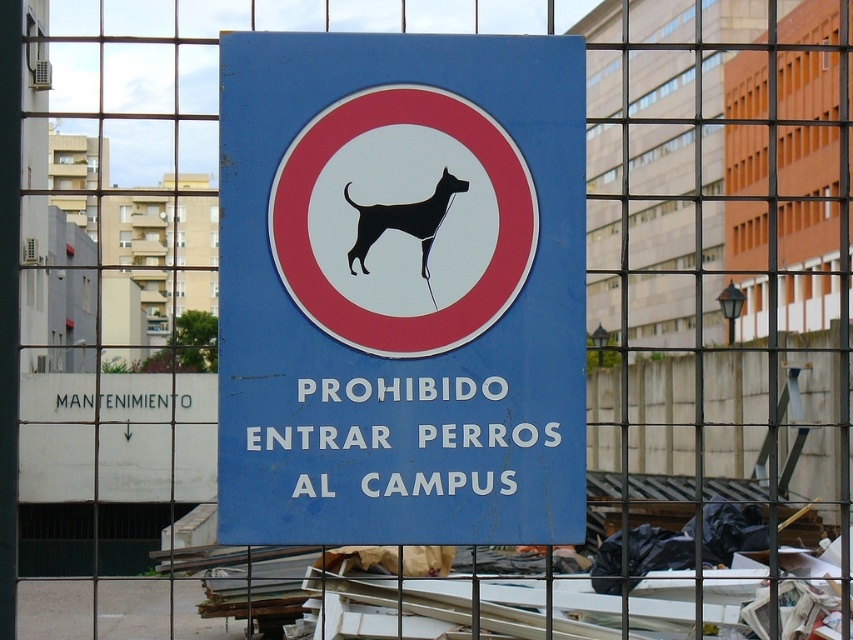
Measure the distance between blue plastic sign at center and black silhouette dog at center.

blue plastic sign at center and black silhouette dog at center are 18.97 inches apart.

Does blue plastic sign at center appear under black silhouette dog at center?

Yes.

Which is behind, point (502, 534) or point (426, 228)?

The point (502, 534) is behind.

Find the location of `blue plastic sign at center`. blue plastic sign at center is located at coordinates (401, 289).